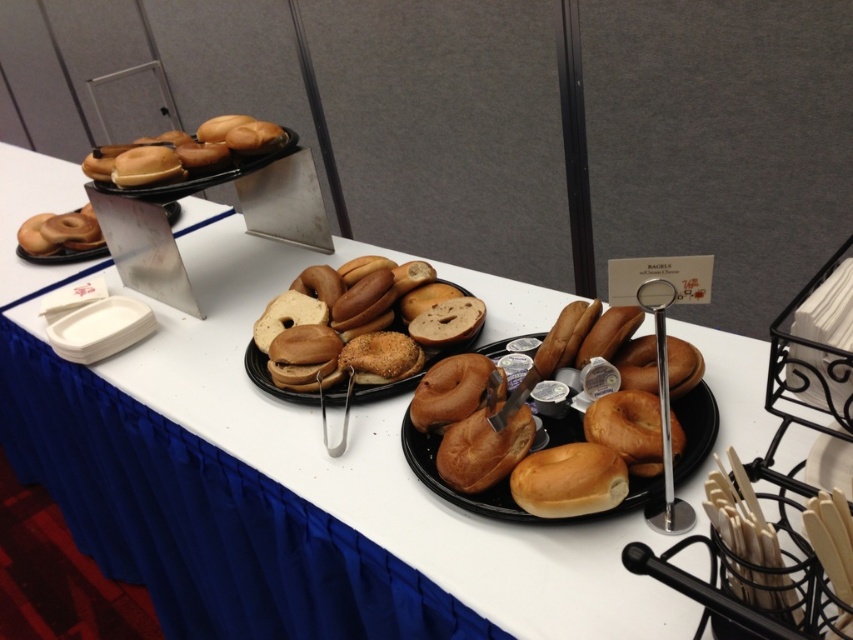
Question: Is brown matte bagels at center bigger than matte black bagel at upper left?

Choices:
 (A) yes
 (B) no

Answer: (B)

Question: Which point appears farthest from the camera in this image?

Choices:
 (A) (367, 394)
 (B) (71, 262)

Answer: (B)

Question: Where is golden brown bagels at center located in relation to brown matte bagels at center in the image?

Choices:
 (A) right
 (B) left

Answer: (A)

Question: Which point appears farthest from the camera in this image?

Choices:
 (A) (169, 216)
 (B) (354, 385)

Answer: (A)

Question: Considering the relative positions of brown matte bagels at center and matte black bagel at upper left in the image provided, where is brown matte bagels at center located with respect to matte black bagel at upper left?

Choices:
 (A) right
 (B) left

Answer: (A)

Question: Based on their relative distances, which object is nearer to the golden brown bagels at center?

Choices:
 (A) matte black bagel at upper left
 (B) brown matte bagels at center

Answer: (B)